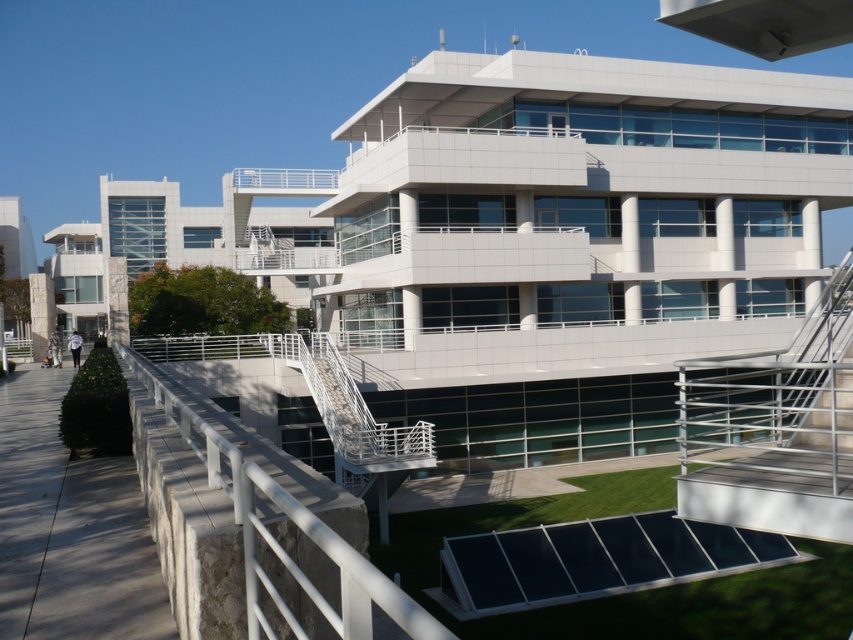
Is white metal/rail at center to the left of metallic silver stairs at center-right from the viewer's perspective?

Indeed, white metal/rail at center is positioned on the left side of metallic silver stairs at center-right.

The image size is (853, 640). I want to click on white metal/rail at center, so click(x=285, y=536).

Locate an element on the screen. Image resolution: width=853 pixels, height=640 pixels. white metal/rail at center is located at coordinates (285, 536).